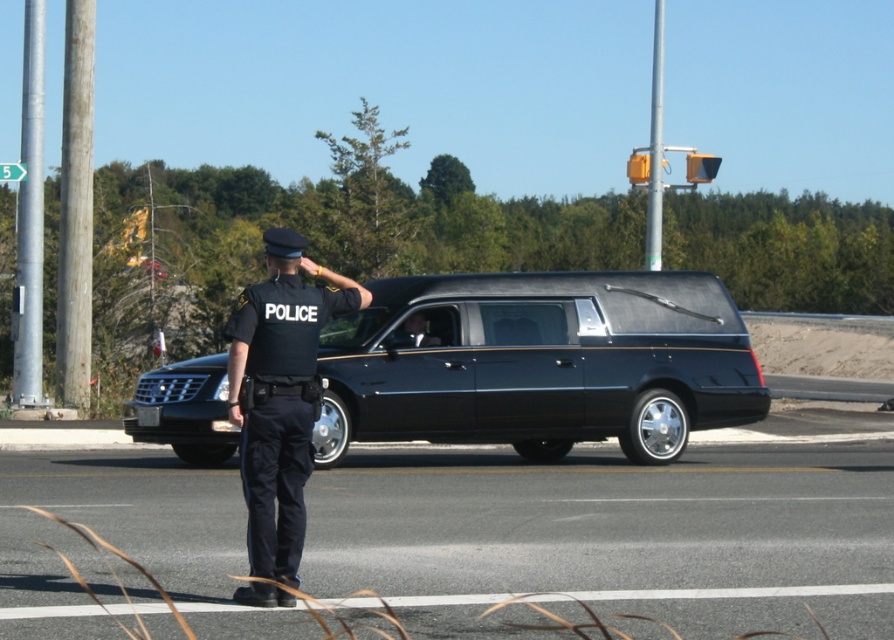
Which is in front, point (617, 323) or point (291, 541)?

Point (291, 541) is in front.

Measure the distance between black glossy hearse at center and camera.

black glossy hearse at center is 59.15 feet away from camera.

In the scene shown: Who is more forward, (x=629, y=364) or (x=296, y=541)?

Point (x=296, y=541) is more forward.

This screenshot has height=640, width=894. I want to click on black glossy hearse at center, so click(538, 362).